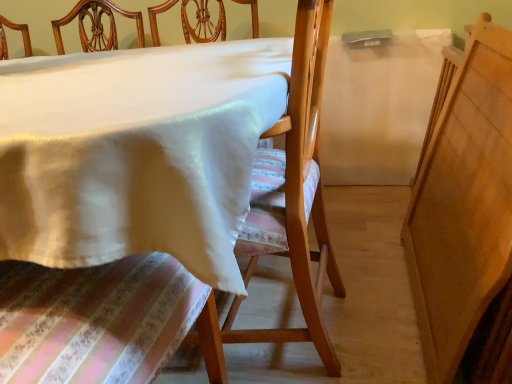
Describe the element at coordinates (136, 153) in the screenshot. The height and width of the screenshot is (384, 512). I see `white glossy table at center` at that location.

Locate an element on the screen. white glossy table at center is located at coordinates (136, 153).

You are a GUI agent. You are given a task and a screenshot of the screen. Output one action in this format:
    pyautogui.click(x=<x>, y=<y>)
    Task: Click on the wooden chair at center
    This screenshot has height=384, width=512.
    Given the screenshot: What is the action you would take?
    pyautogui.click(x=294, y=194)

This screenshot has height=384, width=512. Describe the element at coordinates (294, 194) in the screenshot. I see `wooden chair at center` at that location.

Locate an element on the screen. white glossy table at center is located at coordinates (136, 153).

Considering the relative positions of white glossy table at center and wooden chair at center in the image provided, is white glossy table at center to the left or to the right of wooden chair at center?

white glossy table at center is positioned on wooden chair at center's left side.

Between white glossy table at center and wooden chair at center, which one is positioned behind?

Positioned behind is wooden chair at center.

Considering the positions of point (112, 149) and point (280, 153), is point (112, 149) closer or farther from the camera than point (280, 153)?

Point (112, 149).

From the image's perspective, which one is positioned higher, white glossy table at center or wooden chair at center?

wooden chair at center.

From a real-world perspective, is white glossy table at center physically located above or below wooden chair at center?

white glossy table at center is below wooden chair at center.

Does white glossy table at center have a lesser width compared to wooden chair at center?

Incorrect, the width of white glossy table at center is not less than that of wooden chair at center.

Who is shorter, white glossy table at center or wooden chair at center?

With less height is white glossy table at center.

Considering the sizes of objects white glossy table at center and wooden chair at center in the image provided, who is bigger, white glossy table at center or wooden chair at center?

With larger size is white glossy table at center.

Is white glossy table at center not within wooden chair at center?

Yes, white glossy table at center is not within wooden chair at center.

Based on the photo, is white glossy table at center not near wooden chair at center?

No, there isn't a large distance between white glossy table at center and wooden chair at center.

Is white glossy table at center positioned with its back to wooden chair at center?

white glossy table at center does not have its back to wooden chair at center.

Can you tell me how much white glossy table at center and wooden chair at center differ in facing direction?

180 degrees.

Where is `table to the left of wooden chair at center`? Image resolution: width=512 pixels, height=384 pixels. table to the left of wooden chair at center is located at coordinates (136, 153).

Considering the positions of objects wooden chair at center and white glossy table at center in the image provided, who is more to the right, wooden chair at center or white glossy table at center?

wooden chair at center.

Which object is closer to the camera, wooden chair at center or white glossy table at center?

white glossy table at center is more forward.

Does point (282, 189) come in front of point (267, 46)?

Yes, it is.

From the image's perspective, relative to white glossy table at center, is wooden chair at center above or below?

Based on their image positions, wooden chair at center is located above white glossy table at center.

From a real-world perspective, relative to white glossy table at center, is wooden chair at center vertically above or below?

wooden chair at center is above white glossy table at center.

In terms of width, does wooden chair at center look wider or thinner when compared to white glossy table at center?

wooden chair at center is thinner than white glossy table at center.

In terms of height, does wooden chair at center look taller or shorter compared to white glossy table at center?

Considering their sizes, wooden chair at center has more height than white glossy table at center.

Which of these two, wooden chair at center or white glossy table at center, is smaller?

wooden chair at center is smaller.

Would you say wooden chair at center contains white glossy table at center?

That's incorrect, white glossy table at center is not inside wooden chair at center.

Is wooden chair at center in contact with white glossy table at center?

No, wooden chair at center is not touching white glossy table at center.

Is wooden chair at center oriented away from white glossy table at center?

Yes, wooden chair at center's orientation is away from white glossy table at center.

How much distance is there between wooden chair at center and white glossy table at center?

10.48 inches.

The height and width of the screenshot is (384, 512). In order to click on table lying below the wooden chair at center (from the image's perspective) in this screenshot , I will do `click(136, 153)`.

Identify the location of chair located above the white glossy table at center (from the image's perspective). The height and width of the screenshot is (384, 512). (294, 194).

Where is `table to the left of wooden chair at center`? This screenshot has width=512, height=384. table to the left of wooden chair at center is located at coordinates (136, 153).